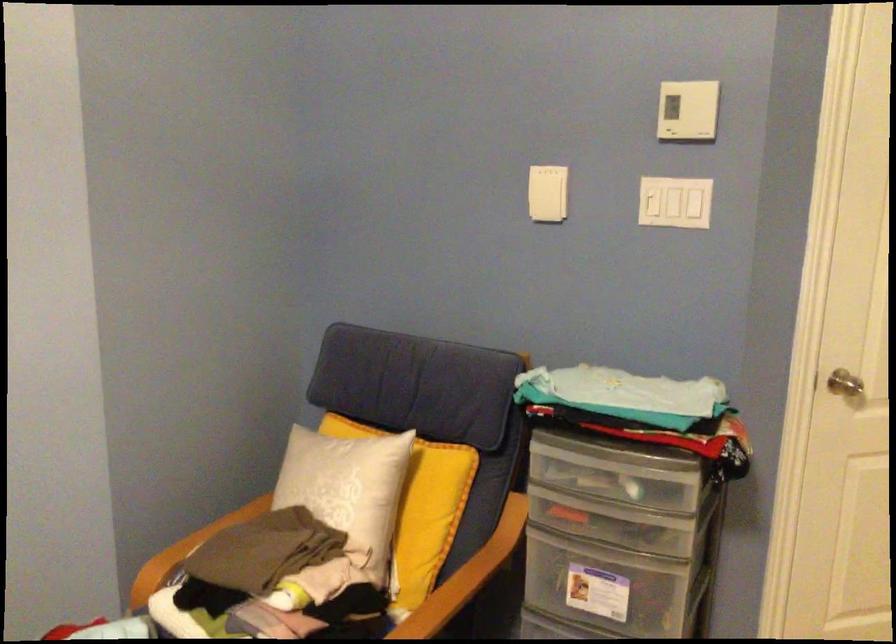
This screenshot has height=644, width=896. Describe the element at coordinates (178, 551) in the screenshot. I see `the wooden chair armrest` at that location.